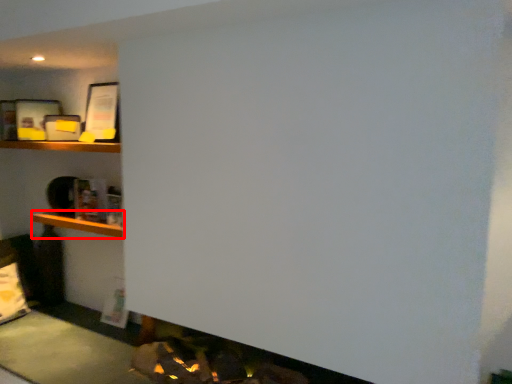
Question: Where is cabinet (annotated by the red box) located in relation to shelf in the image?

Choices:
 (A) left
 (B) right

Answer: (B)